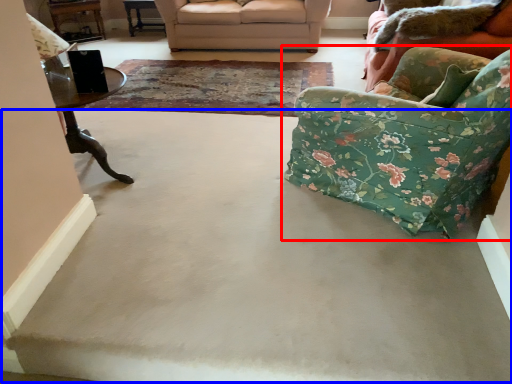
Question: Among these objects, which one is nearest to the camera, chair (highlighted by a red box) or concrete (highlighted by a blue box)?

Choices:
 (A) chair
 (B) concrete

Answer: (A)